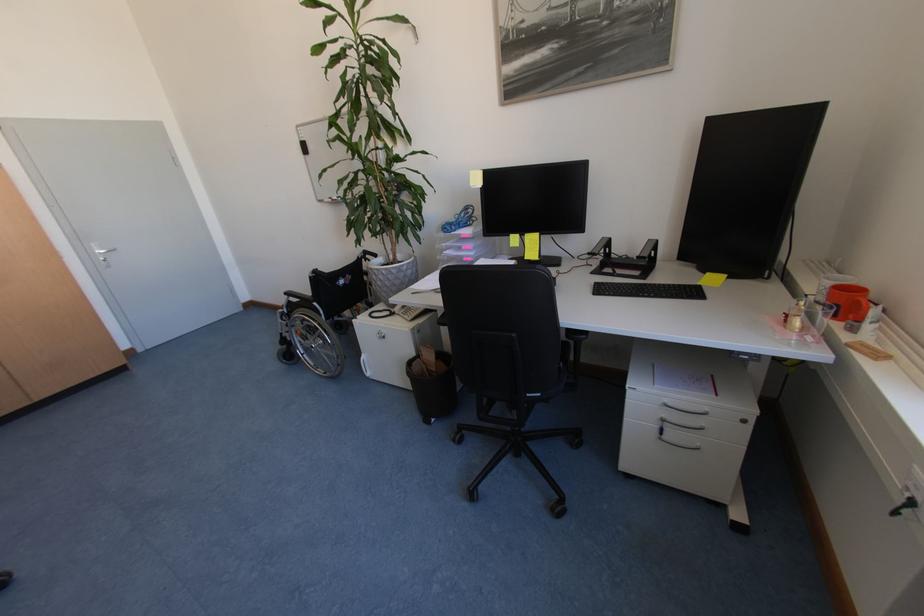
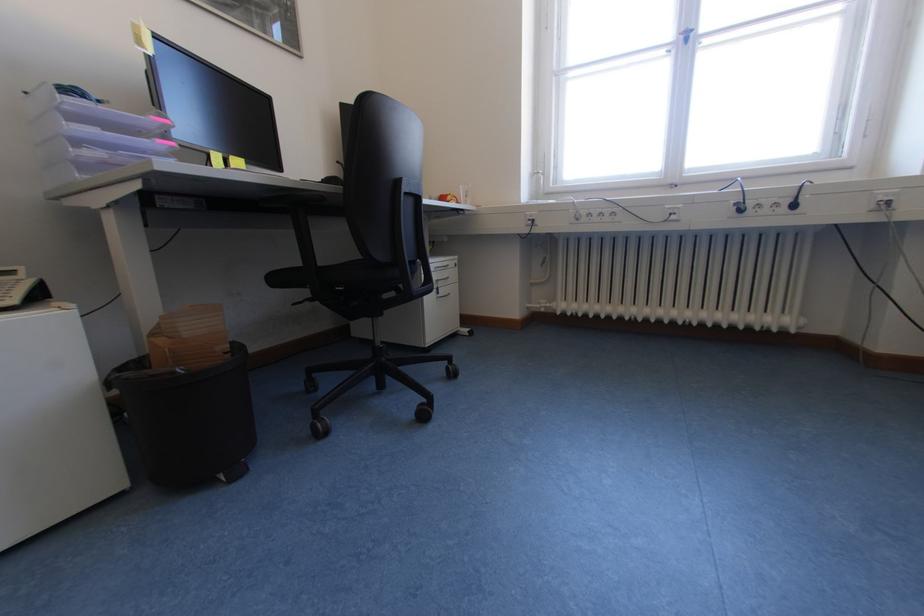
The point at (417, 320) is marked in the first image. Where is the corresponding point in the second image?

(21, 302)